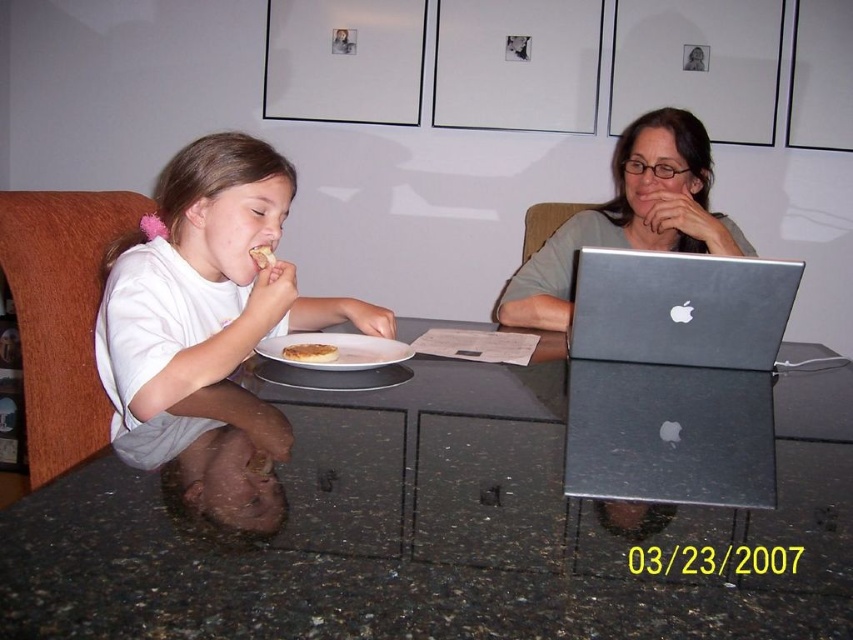
Question: Among these points, which one is nearest to the camera?

Choices:
 (A) (273, 259)
 (B) (792, 445)

Answer: (B)

Question: Is white matte shirt at left below golden brown bread at center?

Choices:
 (A) yes
 (B) no

Answer: (B)

Question: Does silver metallic laptop at center appear on the left side of golden brown bread at center?

Choices:
 (A) yes
 (B) no

Answer: (B)

Question: Can you confirm if golden brown bread at center is positioned below brown crumbly bread at upper center?

Choices:
 (A) no
 (B) yes

Answer: (B)

Question: Among these objects, which one is nearest to the camera?

Choices:
 (A) matte gray laptop at center
 (B) golden brown bread at center

Answer: (B)

Question: Which of the following is the closest to the observer?

Choices:
 (A) silver metallic laptop at center
 (B) white matte plate at center
 (C) white matte shirt at left
 (D) black granite table at center

Answer: (D)